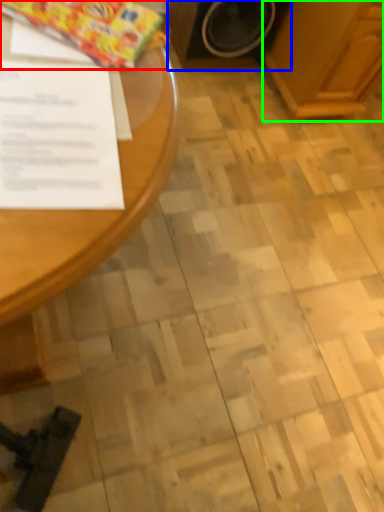
Question: Estimate the real-world distances between objects in this image. Which object is farther from wrapping paper (highlighted by a red box), appliance (highlighted by a blue box) or wood (highlighted by a green box)?

Choices:
 (A) appliance
 (B) wood

Answer: (B)